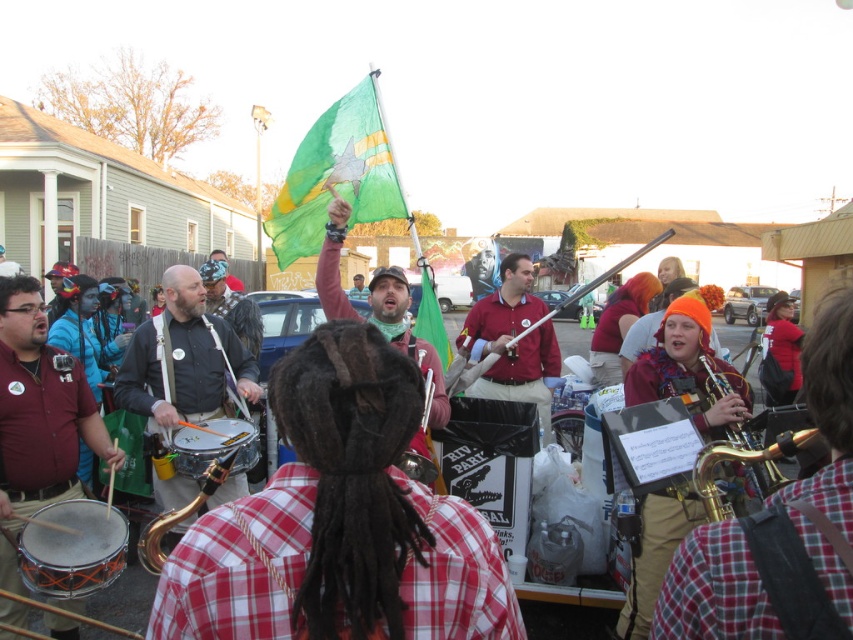
Which of these two, maroon fabric shirt at left or gold brass saxophone at lower right, stands taller?

With more height is maroon fabric shirt at left.

Is point (22, 433) more distant than point (715, 465)?

That is True.

Is point (9, 573) behind point (714, 465)?

Yes.

You are a GUI agent. You are given a task and a screenshot of the screen. Output one action in this format:
    pyautogui.click(x=<x>, y=<y>)
    Task: Click on the maroon fabric shirt at left
    This screenshot has width=853, height=640.
    Given the screenshot: What is the action you would take?
    pyautogui.click(x=39, y=408)

Which is more to the right, maroon shirt at center or gold brass saxophone at center?

From the viewer's perspective, maroon shirt at center appears more on the right side.

Does maroon shirt at center have a lesser height compared to gold brass saxophone at center?

Incorrect, maroon shirt at center's height does not fall short of gold brass saxophone at center's.

The image size is (853, 640). I want to click on maroon shirt at center, so click(514, 344).

Between shiny black drum at center and maroon shirt at center, which one has more height?

maroon shirt at center is taller.

From the picture: Is shiny black drum at center shorter than maroon shirt at center?

Yes, shiny black drum at center is shorter than maroon shirt at center.

Describe the element at coordinates (183, 358) in the screenshot. I see `shiny black drum at center` at that location.

The height and width of the screenshot is (640, 853). In order to click on shiny black drum at center in this screenshot , I will do tap(183, 358).